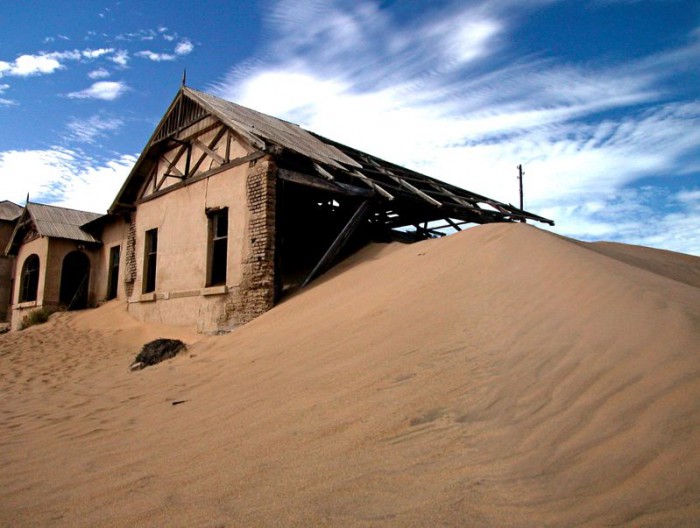
This screenshot has height=528, width=700. Find the location of `rectangle windows`. rectangle windows is located at coordinates (216, 247), (150, 253), (108, 274).